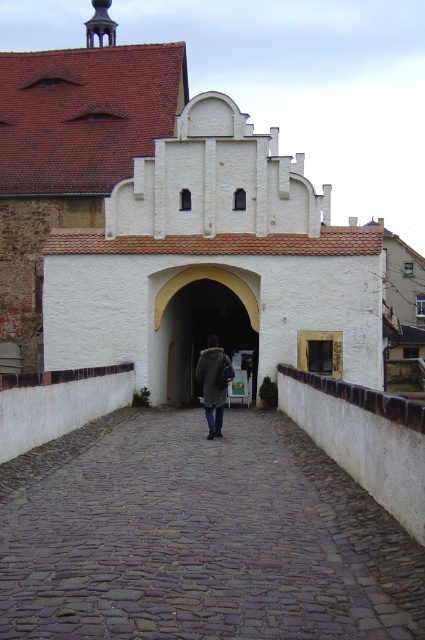
Between smooth white archway at center and dark gray wool coat at center, which one is positioned lower?

dark gray wool coat at center is below.

Which of these two, smooth white archway at center or dark gray wool coat at center, stands taller?

smooth white archway at center is taller.

Who is more forward, (x=255, y=371) or (x=200, y=353)?

Point (x=255, y=371)

Identify the location of smooth white archway at center. (201, 324).

Which is behind, point (67, 532) or point (206, 362)?

Positioned behind is point (206, 362).

Does cobblestone path at center have a lesser width compared to dark gray wool coat at center?

No.

Describe the element at coordinates (198, 538) in the screenshot. I see `cobblestone path at center` at that location.

Identify the location of cobblestone path at center. (198, 538).

What do you see at coordinates (198, 538) in the screenshot? I see `cobblestone path at center` at bounding box center [198, 538].

Is cobblestone path at center taller than smooth white archway at center?

No, cobblestone path at center is not taller than smooth white archway at center.

Is point (362, 492) closer to viewer compared to point (226, 324)?

Yes, it is in front of point (226, 324).

Locate an element on the screen. Image resolution: width=425 pixels, height=640 pixels. cobblestone path at center is located at coordinates (x=198, y=538).